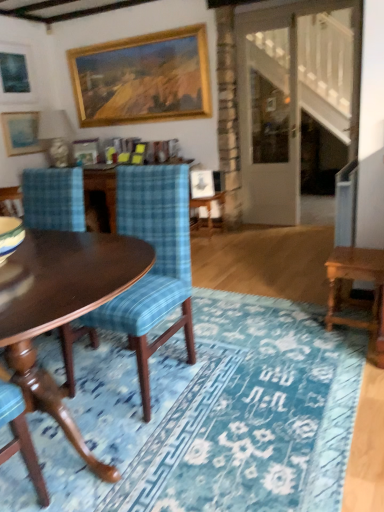
You are a GUI agent. You are given a task and a screenshot of the screen. Output one action in this format:
    pyautogui.click(x=<x>, y=<y>)
    Task: Click on the free space in front of wooden table at right
    This screenshot has width=384, height=512.
    Given the screenshot: What is the action you would take?
    pyautogui.click(x=347, y=349)